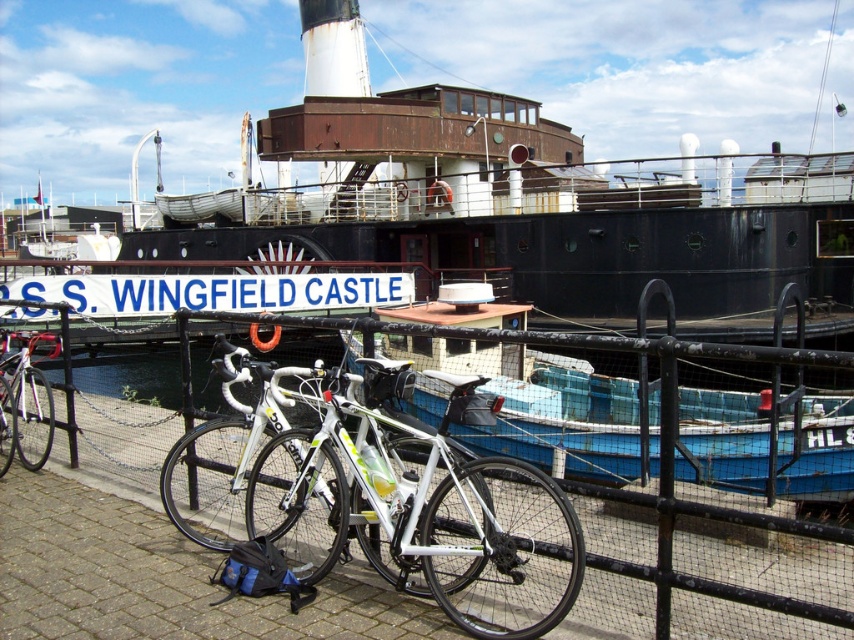
Question: Among these points, which one is nearest to the camera?

Choices:
 (A) (98, 148)
 (B) (495, 557)
 (C) (657, 390)

Answer: (B)

Question: Is blue plastic boat at center to the right of shiny silver bicycle at left from the viewer's perspective?

Choices:
 (A) no
 (B) yes

Answer: (B)

Question: Considering the real-world distances, which object is closest to the blue plastic boat at center?

Choices:
 (A) black metal fence at lower center
 (B) white glossy bicycle at center
 (C) shiny silver bicycle at left
 (D) rusty metal ship at center

Answer: (A)

Question: Is rusty metal ship at center bigger than black metal fence at lower center?

Choices:
 (A) yes
 (B) no

Answer: (A)

Question: Which of the following is the farthest from the observer?

Choices:
 (A) (826, 19)
 (B) (692, 410)
 (C) (39, 419)

Answer: (A)

Question: Does blue plastic boat at center appear under black metal fence at lower center?

Choices:
 (A) no
 (B) yes

Answer: (B)